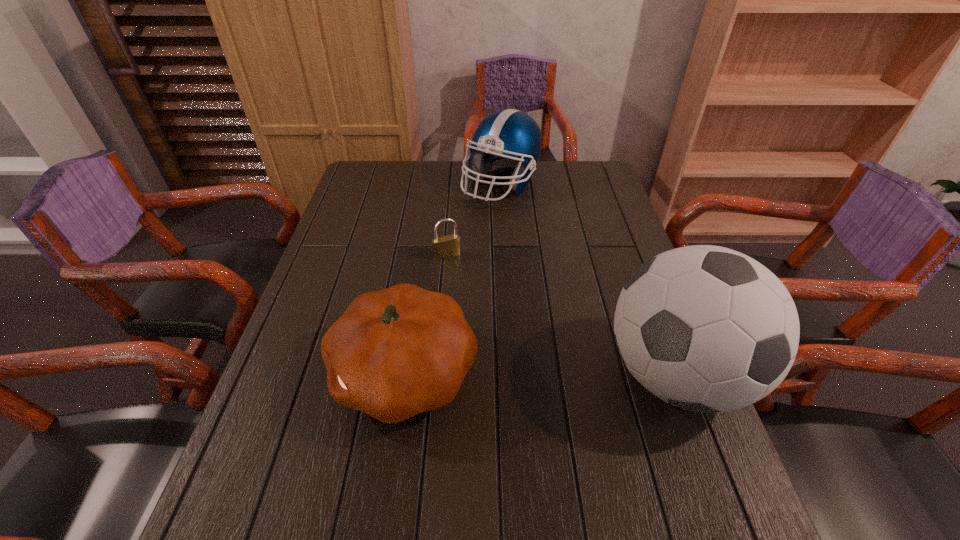
Locate an element on the screen. free space at the near edge is located at coordinates (378, 447).

Where is `free spot at the left edge of the desktop`? Image resolution: width=960 pixels, height=540 pixels. free spot at the left edge of the desktop is located at coordinates (354, 213).

Identify the location of vacant space at the right edge of the desktop. The image size is (960, 540). (596, 234).

The width and height of the screenshot is (960, 540). I want to click on vacant region at the far left corner of the desktop, so click(398, 174).

Image resolution: width=960 pixels, height=540 pixels. Identify the location of free spot between the second farthest object and the farthest object. (474, 220).

Identify the location of free point between the pumpkin and the football helmet. (453, 279).

Where is `free area in between the soccer ball and the padlock`? free area in between the soccer ball and the padlock is located at coordinates (562, 315).

This screenshot has width=960, height=540. What are the coordinates of `free space between the pumpkin and the soccer ball` in the screenshot? It's located at (540, 374).

Identify the location of empty location between the tallest object and the pumpkin. The image size is (960, 540). (540, 374).

I want to click on vacant area that lies between the soccer ball and the football helmet, so click(x=588, y=280).